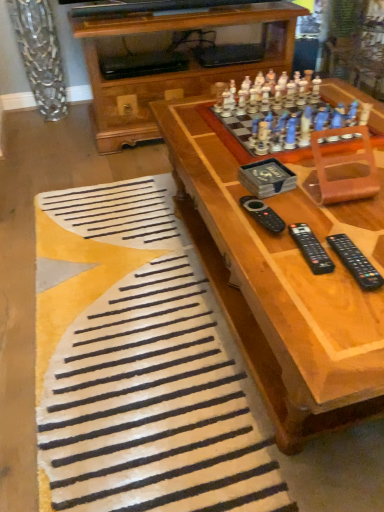
Identify the location of free space to the left of black plastic remote at center, which is counted as the 1th remote, starting from the left. (223, 213).